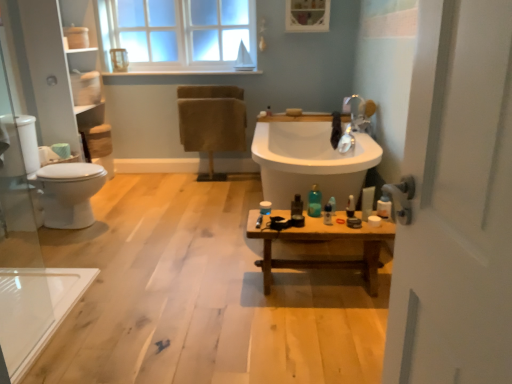
Question: Considering the relative sizes of clear glass window at upper center and transparent glass door at left in the image provided, is clear glass window at upper center shorter than transparent glass door at left?

Choices:
 (A) no
 (B) yes

Answer: (B)

Question: From a real-world perspective, is clear glass window at upper center beneath transparent glass door at left?

Choices:
 (A) yes
 (B) no

Answer: (B)

Question: Does clear glass window at upper center have a larger size compared to transparent glass door at left?

Choices:
 (A) yes
 (B) no

Answer: (A)

Question: Is clear glass window at upper center positioned with its back to transparent glass door at left?

Choices:
 (A) no
 (B) yes

Answer: (A)

Question: From the image's perspective, is clear glass window at upper center beneath transparent glass door at left?

Choices:
 (A) no
 (B) yes

Answer: (A)

Question: Can you see clear glass window at upper center touching transparent glass door at left?

Choices:
 (A) yes
 (B) no

Answer: (B)

Question: Does translucent plastic bottle at right, which is the sixth toiletry from left to right, touch translucent plastic bottle at center, the fifth toiletry when ordered from right to left?

Choices:
 (A) yes
 (B) no

Answer: (B)

Question: Is translucent plastic bottle at right, marked as the 1th toiletry in a right-to-left arrangement, outside translucent plastic bottle at center, which is counted as the 2th toiletry, starting from the left?

Choices:
 (A) yes
 (B) no

Answer: (A)

Question: Can you confirm if translucent plastic bottle at right, marked as the 1th toiletry in a right-to-left arrangement, is positioned to the left of translucent plastic bottle at center, which is counted as the 2th toiletry, starting from the left?

Choices:
 (A) no
 (B) yes

Answer: (A)

Question: Considering the relative sizes of translucent plastic bottle at right, which is the sixth toiletry from left to right, and translucent plastic bottle at center, the fifth toiletry when ordered from right to left, in the image provided, is translucent plastic bottle at right, which is the sixth toiletry from left to right, thinner than translucent plastic bottle at center, the fifth toiletry when ordered from right to left,?

Choices:
 (A) no
 (B) yes

Answer: (B)

Question: Considering the relative positions of translucent plastic bottle at right, marked as the 1th toiletry in a right-to-left arrangement, and translucent plastic bottle at center, the fifth toiletry when ordered from right to left, in the image provided, is translucent plastic bottle at right, marked as the 1th toiletry in a right-to-left arrangement, to the right of translucent plastic bottle at center, the fifth toiletry when ordered from right to left, from the viewer's perspective?

Choices:
 (A) yes
 (B) no

Answer: (A)

Question: Is translucent plastic bottle at right, marked as the 1th toiletry in a right-to-left arrangement, positioned before translucent plastic bottle at center, the fifth toiletry when ordered from right to left?

Choices:
 (A) yes
 (B) no

Answer: (A)

Question: Does white glossy toilet at left come behind translucent plastic bottle at center, which is the 6th toiletry in right-to-left order?

Choices:
 (A) no
 (B) yes

Answer: (B)